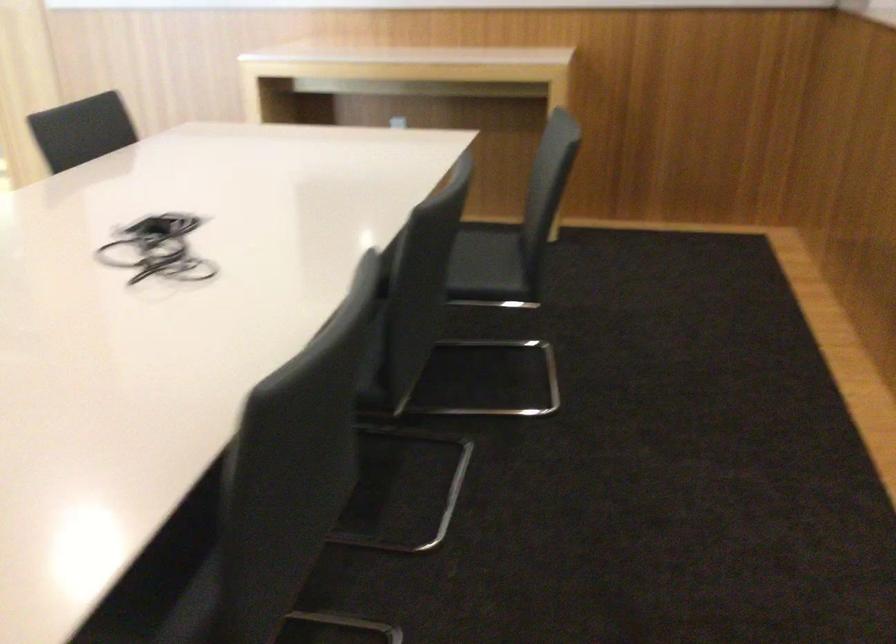
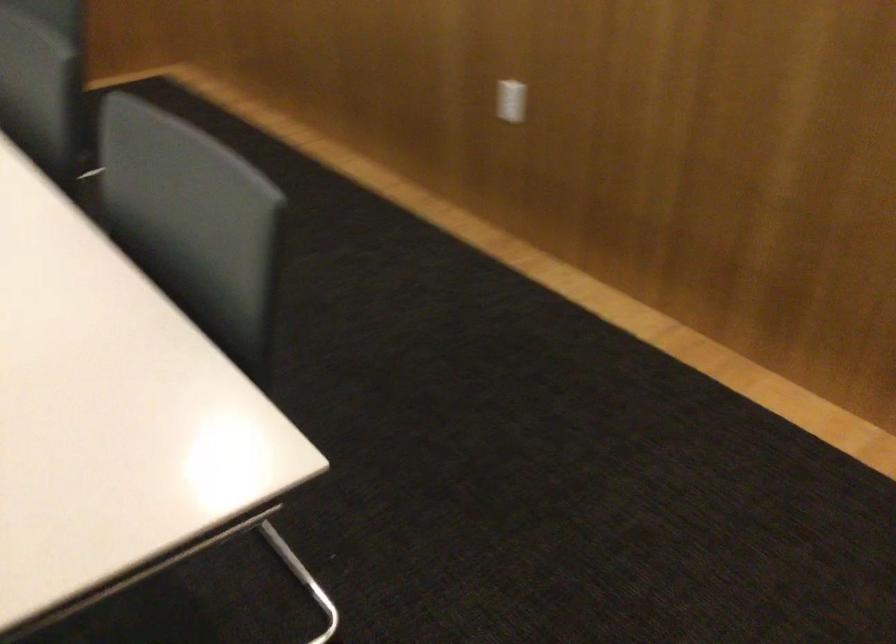
First-person continuous shooting, in which direction is the camera rotating?

The camera's rotation is toward right-down.